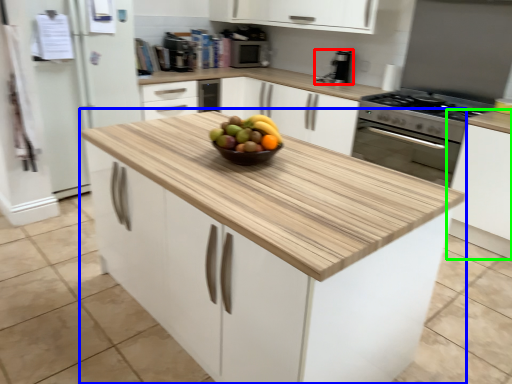
Question: Which object is the farthest from kitchen appliance (highlighted by a red box)? Choose among these: cabinetry (highlighted by a blue box) or cabinetry (highlighted by a green box).

Choices:
 (A) cabinetry
 (B) cabinetry

Answer: (A)